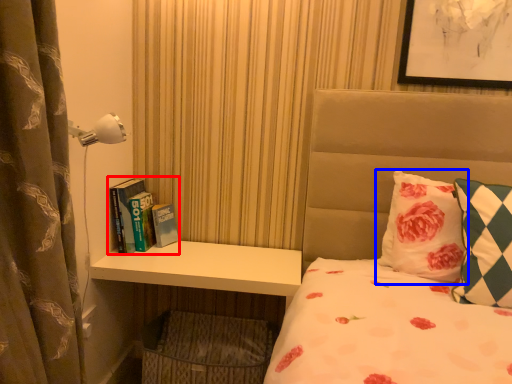
Question: Which object is closer to the camera taking this photo, book (highlighted by a red box) or pillow (highlighted by a blue box)?

Choices:
 (A) book
 (B) pillow

Answer: (B)